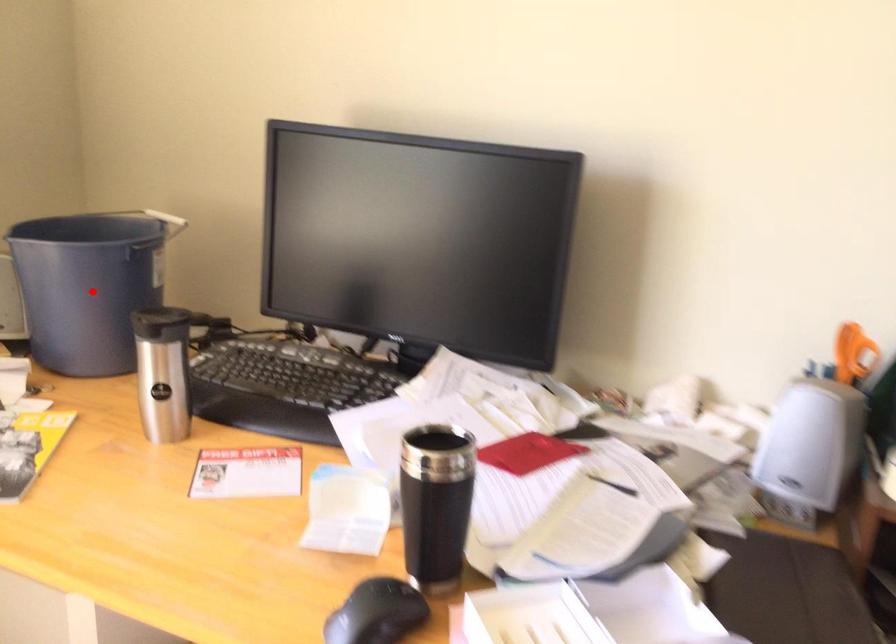
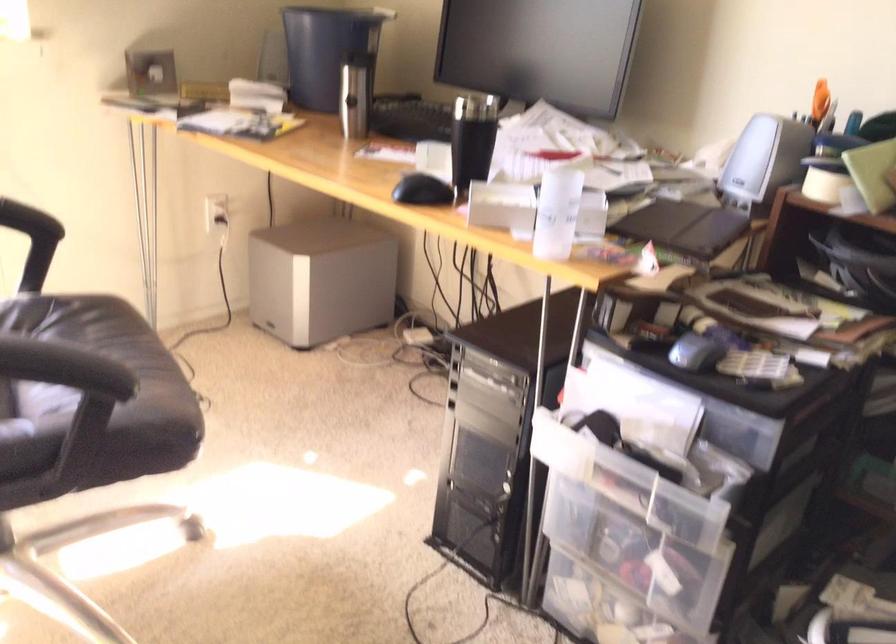
Find the pixel in the second image that matches the highlighted location in the first image.

(324, 50)